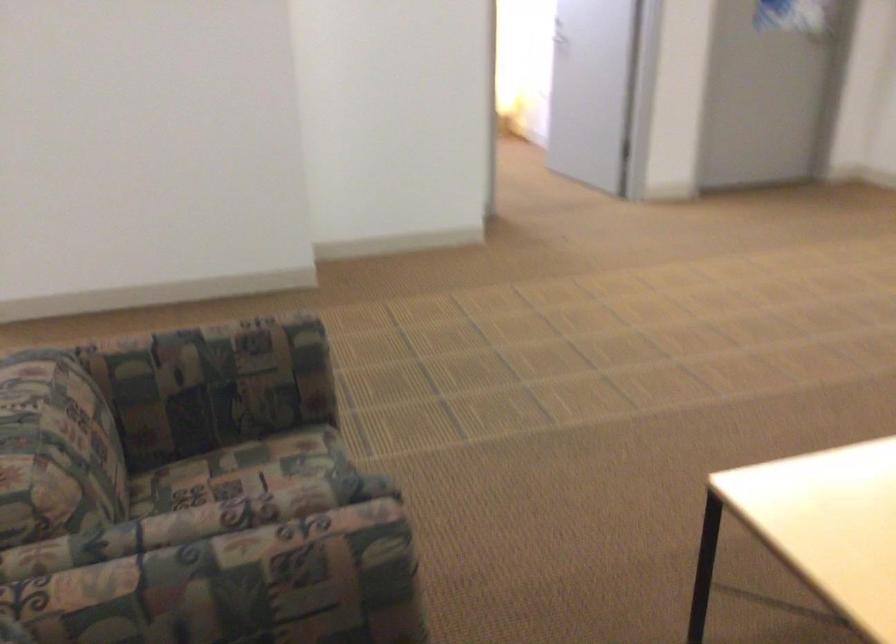
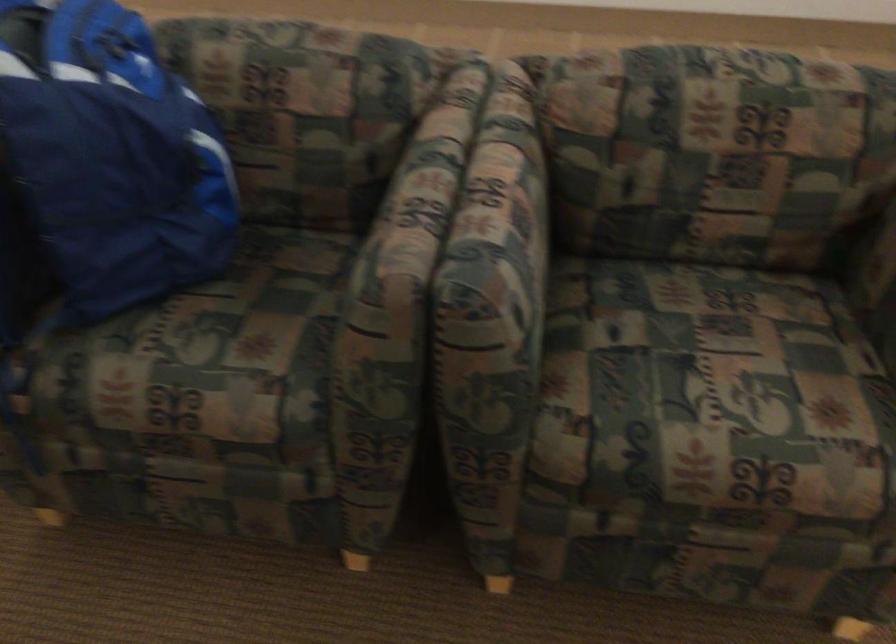
The point at (298, 529) is marked in the first image. Where is the corresponding point in the second image?

(412, 207)